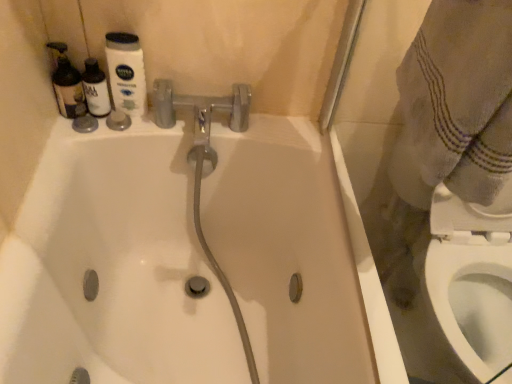
Question: Does white plastic bidet at lower right come in front of white glossy bathtub at center?

Choices:
 (A) yes
 (B) no

Answer: (B)

Question: Could you tell me if white plastic bidet at lower right is turned towards white glossy bathtub at center?

Choices:
 (A) yes
 (B) no

Answer: (B)

Question: From the image's perspective, is white plastic bidet at lower right located above white glossy bathtub at center?

Choices:
 (A) no
 (B) yes

Answer: (A)

Question: Can you confirm if white plastic bidet at lower right is wider than white glossy bathtub at center?

Choices:
 (A) yes
 (B) no

Answer: (B)

Question: From the image's perspective, is white plastic bidet at lower right beneath white glossy bathtub at center?

Choices:
 (A) yes
 (B) no

Answer: (A)

Question: Does white plastic bidet at lower right have a lesser width compared to white glossy bathtub at center?

Choices:
 (A) no
 (B) yes

Answer: (B)

Question: Does white glossy bathtub at center have a lesser height compared to white plastic bidet at lower right?

Choices:
 (A) no
 (B) yes

Answer: (A)

Question: Is white glossy bathtub at center to the left of white plastic bidet at lower right from the viewer's perspective?

Choices:
 (A) no
 (B) yes

Answer: (B)

Question: From a real-world perspective, is white glossy bathtub at center located beneath white plastic bidet at lower right?

Choices:
 (A) yes
 (B) no

Answer: (B)

Question: Considering the relative sizes of white glossy bathtub at center and white plastic bidet at lower right in the image provided, is white glossy bathtub at center thinner than white plastic bidet at lower right?

Choices:
 (A) yes
 (B) no

Answer: (B)

Question: Is white glossy bathtub at center completely or partially outside of white plastic bidet at lower right?

Choices:
 (A) yes
 (B) no

Answer: (A)

Question: From the image's perspective, is white glossy bathtub at center beneath white plastic bidet at lower right?

Choices:
 (A) yes
 (B) no

Answer: (B)

Question: In terms of size, does white plastic bidet at lower right appear bigger or smaller than white glossy bathtub at center?

Choices:
 (A) big
 (B) small

Answer: (B)